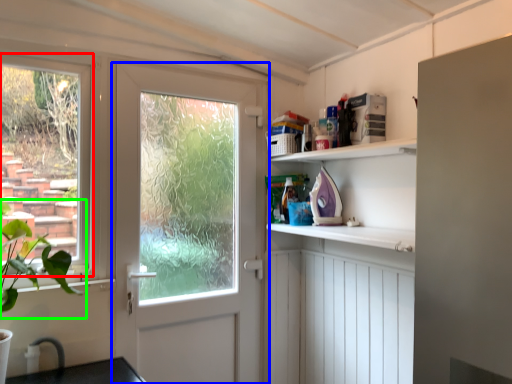
Question: Considering the real-world distances, which object is closest to window (highlighted by a red box)? door (highlighted by a blue box) or plant (highlighted by a green box).

Choices:
 (A) door
 (B) plant

Answer: (B)